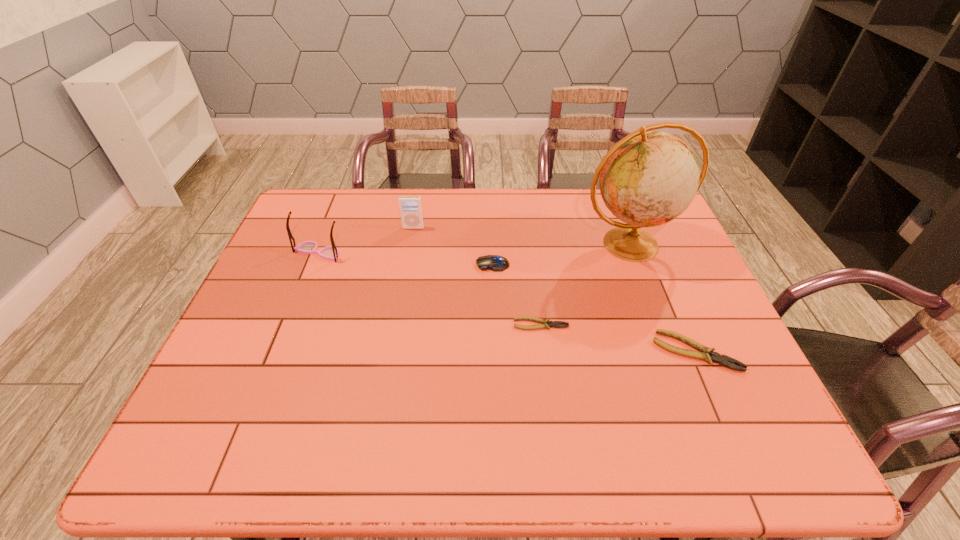
Locate an element on the screen. the shorter pliers is located at coordinates (546, 323).

At what (x,y) coordinates should I click in order to perform the action: click on the shortest object. Please return your answer as a coordinate pair (x, y). Looking at the image, I should click on [x=546, y=323].

Find the location of a particular element. the second shortest object is located at coordinates (705, 352).

Find the location of `the nearest object`. the nearest object is located at coordinates click(x=705, y=352).

Where is `globe`? Image resolution: width=960 pixels, height=540 pixels. globe is located at coordinates (648, 178).

At what (x,y) coordinates should I click in order to perform the action: click on the leftmost object. Please return your answer as a coordinate pair (x, y). This screenshot has height=540, width=960. Looking at the image, I should click on (331, 253).

Identify the location of iPod. This screenshot has height=540, width=960. (411, 212).

This screenshot has width=960, height=540. What are the coordinates of `the fourth tallest object` in the screenshot? It's located at (496, 263).

In order to click on vacant area situated on the left of the farther pliers in this screenshot , I will do `click(389, 324)`.

Find the location of a particular element. free spot located 0.320m on the left of the nearer pliers is located at coordinates (524, 351).